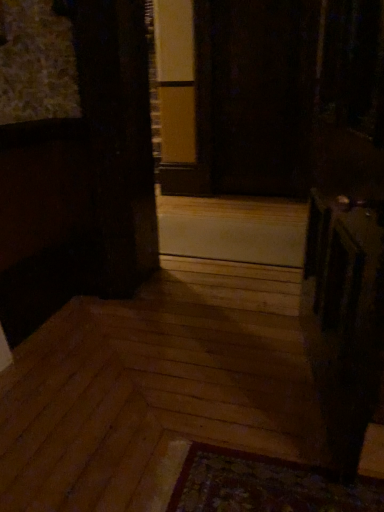
Question: Can you confirm if white matte panel at center is positioned to the right of transparent glass screen door at center?

Choices:
 (A) no
 (B) yes

Answer: (A)

Question: Is white matte panel at center smaller than transparent glass screen door at center?

Choices:
 (A) yes
 (B) no

Answer: (A)

Question: Is white matte panel at center in contact with transparent glass screen door at center?

Choices:
 (A) yes
 (B) no

Answer: (B)

Question: Is white matte panel at center outside of transparent glass screen door at center?

Choices:
 (A) yes
 (B) no

Answer: (A)

Question: Does white matte panel at center turn towards transparent glass screen door at center?

Choices:
 (A) yes
 (B) no

Answer: (B)

Question: Considering the relative sizes of white matte panel at center and transparent glass screen door at center in the image provided, is white matte panel at center thinner than transparent glass screen door at center?

Choices:
 (A) yes
 (B) no

Answer: (B)

Question: From a real-world perspective, does transparent glass screen door at center sit lower than white matte panel at center?

Choices:
 (A) no
 (B) yes

Answer: (A)

Question: Is transparent glass screen door at center shorter than white matte panel at center?

Choices:
 (A) no
 (B) yes

Answer: (A)

Question: Considering the relative positions of transparent glass screen door at center and white matte panel at center in the image provided, is transparent glass screen door at center to the left of white matte panel at center from the viewer's perspective?

Choices:
 (A) yes
 (B) no

Answer: (B)

Question: From the image's perspective, is transparent glass screen door at center over white matte panel at center?

Choices:
 (A) no
 (B) yes

Answer: (B)

Question: Is transparent glass screen door at center at the right side of white matte panel at center?

Choices:
 (A) no
 (B) yes

Answer: (B)

Question: From a real-world perspective, is transparent glass screen door at center positioned over white matte panel at center based on gravity?

Choices:
 (A) yes
 (B) no

Answer: (A)

Question: Considering the positions of transparent glass screen door at center and white matte panel at center in the image, is transparent glass screen door at center taller or shorter than white matte panel at center?

Choices:
 (A) short
 (B) tall

Answer: (B)